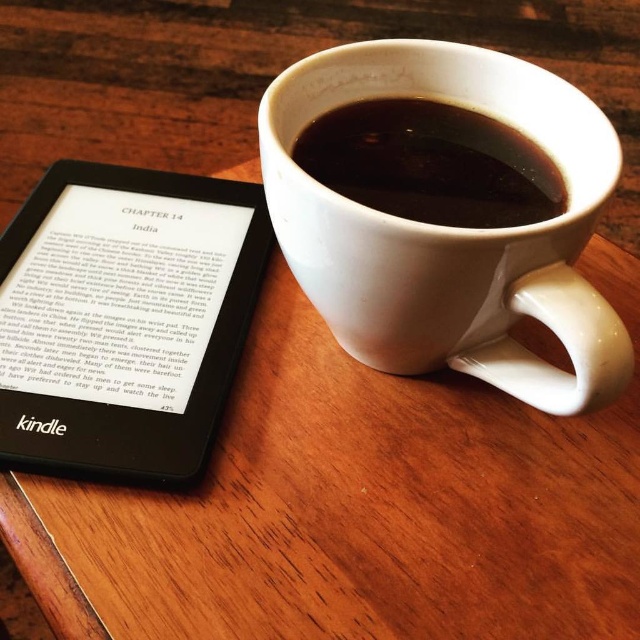
Is white ceramic mug at upper center smaller than black glossy mug at upper center?

Actually, white ceramic mug at upper center might be larger than black glossy mug at upper center.

Is point (531, 131) in front of point (328, 180)?

No.

This screenshot has height=640, width=640. Identify the location of white ceramic mug at upper center. (448, 227).

Can you confirm if black matte kindle at left is positioned to the right of black glossy mug at upper center?

Incorrect, black matte kindle at left is not on the right side of black glossy mug at upper center.

Where is `black matte kindle at left`? black matte kindle at left is located at coordinates (124, 317).

Find the location of `black matte kindle at left`. black matte kindle at left is located at coordinates (124, 317).

Which of these two, white ceramic mug at upper center or black matte kindle at left, stands taller?

Standing taller between the two is white ceramic mug at upper center.

Is point (403, 289) positioned in front of point (100, 467)?

That is True.

Between point (476, 256) and point (54, 358), which one is positioned in front?

Point (476, 256) is more forward.

At what (x,y) coordinates should I click in order to perform the action: click on white ceramic mug at upper center. Please return your answer as a coordinate pair (x, y). Looking at the image, I should click on (448, 227).